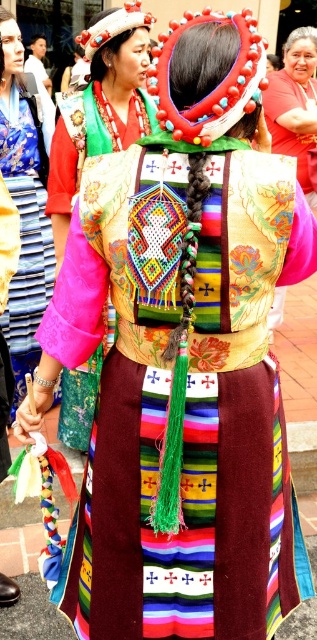
Where is `velvet dress at center`? velvet dress at center is located at coordinates point(99,108).

Is velvet dress at center to the left of matte red blouse at center from the viewer's perspective?

Yes, velvet dress at center is to the left of matte red blouse at center.

Is point (62, 417) positioned behind point (291, 100)?

No, (62, 417) is closer to viewer.

Identify the location of velvet dress at center. (99, 108).

Looking at this image, does velvet pink blouse at center have a larger size compared to matte red blouse at center?

Actually, velvet pink blouse at center might be smaller than matte red blouse at center.

How distant is velvet pink blouse at center from matte red blouse at center?

The distance of velvet pink blouse at center from matte red blouse at center is 2.23 meters.

Between point (19, 372) and point (266, 125), which one is positioned behind?

The point (266, 125) is more distant.

Locate an element on the screen. This screenshot has height=640, width=317. velvet pink blouse at center is located at coordinates (24, 209).

Is velvet dress at center to the left of velvet pink blouse at center from the viewer's perspective?

In fact, velvet dress at center is to the right of velvet pink blouse at center.

Can you confirm if velvet dress at center is positioned below velvet pink blouse at center?

No, velvet dress at center is not below velvet pink blouse at center.

Is point (105, 72) in front of point (31, 196)?

That is True.

The width and height of the screenshot is (317, 640). What are the coordinates of `velvet dress at center` in the screenshot? It's located at (99, 108).